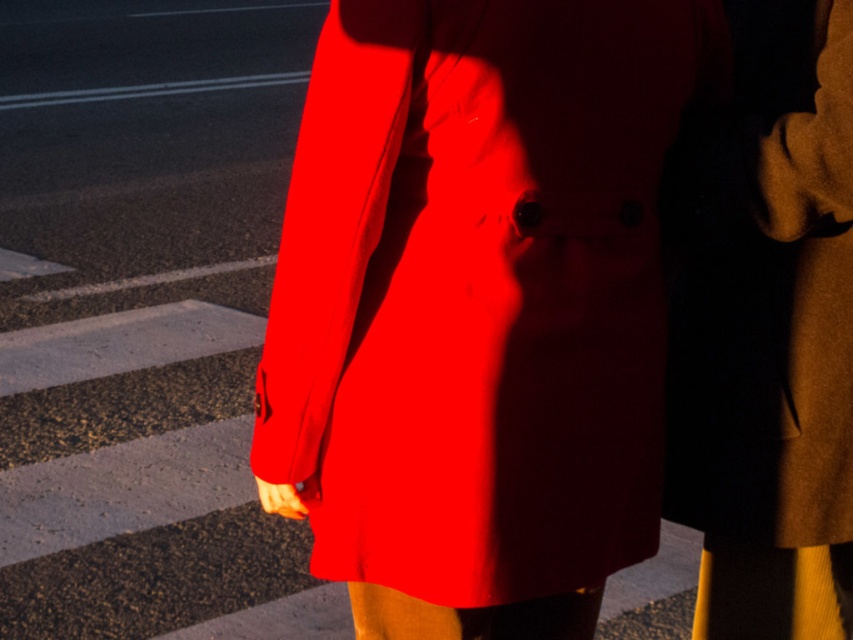
Question: Which object appears closest to the camera in this image?

Choices:
 (A) brown woolen trench coat at right
 (B) matte red coat at center

Answer: (A)

Question: Is matte red coat at center positioned in front of brown woolen trench coat at right?

Choices:
 (A) yes
 (B) no

Answer: (B)

Question: Which point is closer to the camera taking this photo?

Choices:
 (A) (793, 4)
 (B) (328, 445)

Answer: (B)

Question: Is matte red coat at center below brown woolen trench coat at right?

Choices:
 (A) yes
 (B) no

Answer: (B)

Question: Which of the following is the farthest from the observer?

Choices:
 (A) matte red coat at center
 (B) brown woolen trench coat at right

Answer: (A)

Question: Does matte red coat at center have a lesser width compared to brown woolen trench coat at right?

Choices:
 (A) no
 (B) yes

Answer: (A)